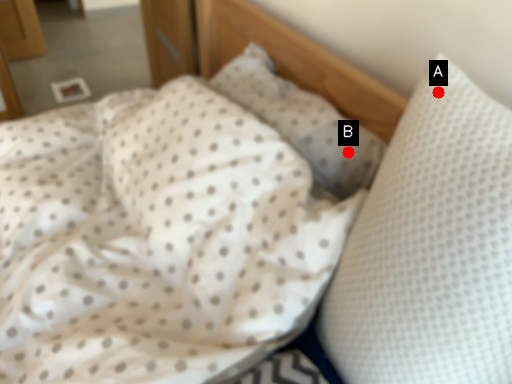
Question: Two points are circled on the image, labeled by A and B beside each circle. Among these points, which one is nearest to the camera?

Choices:
 (A) A is closer
 (B) B is closer

Answer: (A)